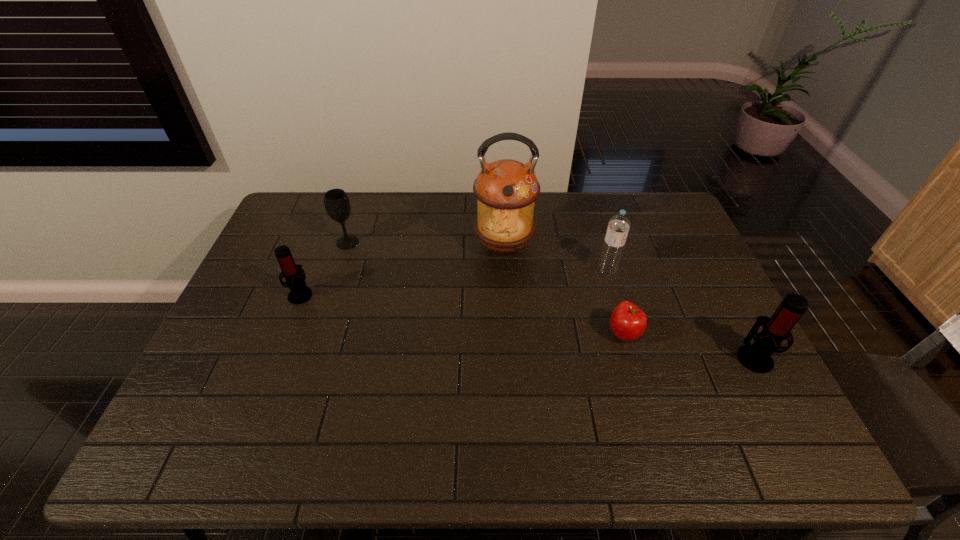
Find the location of a particular element. Image resolution: width=960 pixels, height=540 pixels. the shorter microphone is located at coordinates (299, 293).

Locate an element on the screen. This screenshot has width=960, height=540. the farther microphone is located at coordinates (299, 293).

Identify the location of the taller microphone. Image resolution: width=960 pixels, height=540 pixels. (757, 357).

This screenshot has width=960, height=540. What are the coordinates of `the right microphone` in the screenshot? It's located at (757, 357).

Where is `the fifth object from right to left`? This screenshot has height=540, width=960. the fifth object from right to left is located at coordinates (336, 202).

Find the location of a particular element. This screenshot has height=540, width=960. water bottle is located at coordinates (618, 226).

Identify the location of apple. The image size is (960, 540). (628, 322).

This screenshot has height=540, width=960. Identify the location of the tallest object. (506, 190).

The width and height of the screenshot is (960, 540). Find the location of `the fourth object from right to left`. the fourth object from right to left is located at coordinates (506, 190).

Image resolution: width=960 pixels, height=540 pixels. I want to click on free space located 0.260m on the right of the third nearest object, so click(401, 294).